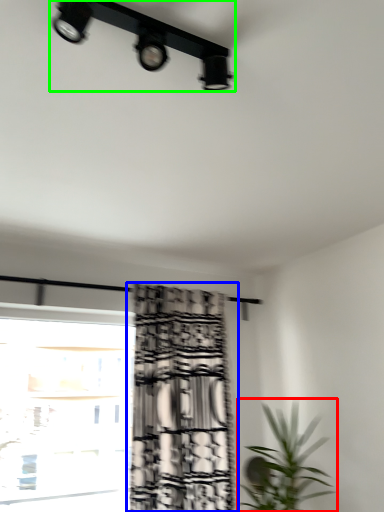
Question: Estimate the real-world distances between objects in this image. Which object is farther from houseplant (highlighted by a red box), curtain (highlighted by a blue box) or lamp (highlighted by a green box)?

Choices:
 (A) curtain
 (B) lamp

Answer: (B)